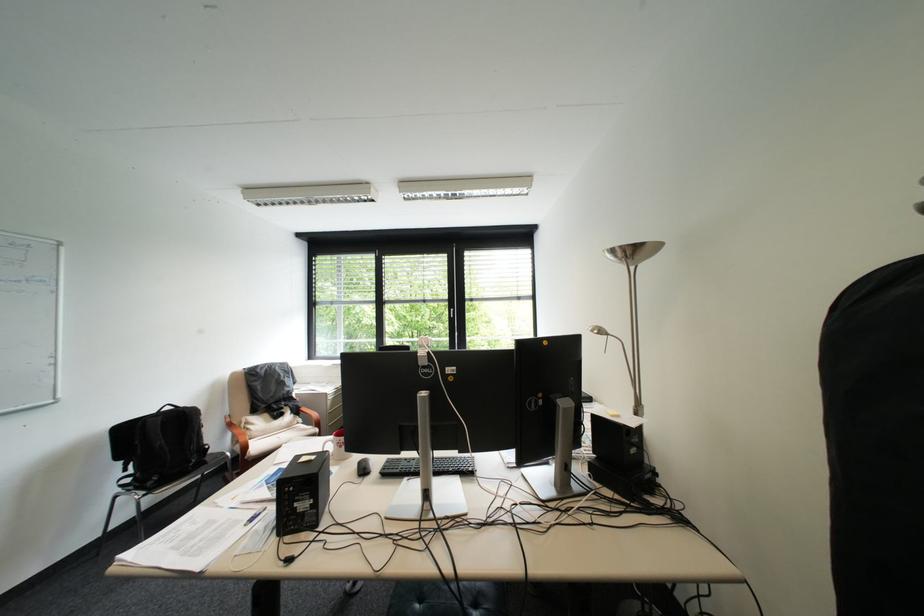
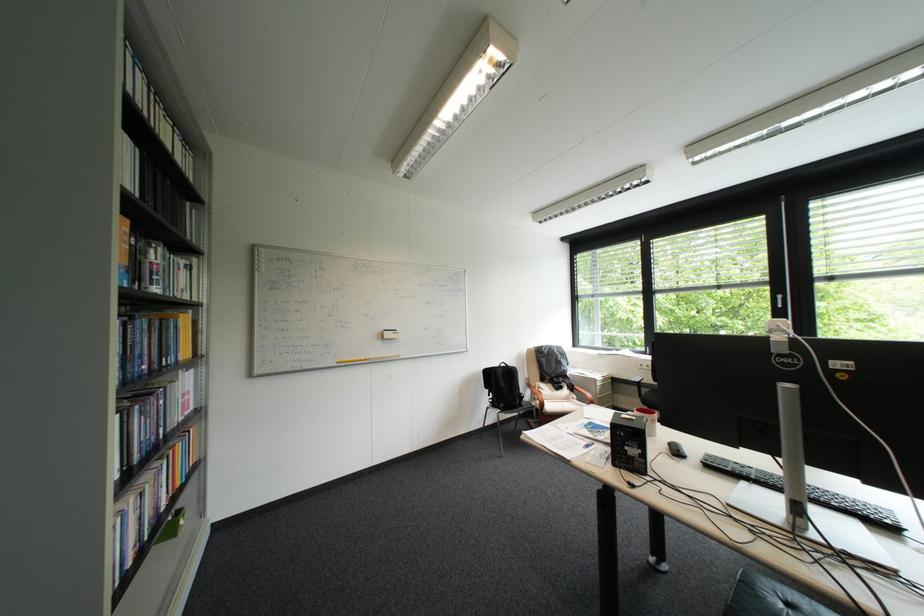
Locate, in the second image, the point that corresponds to (338,394) in the first image.

(608, 379)